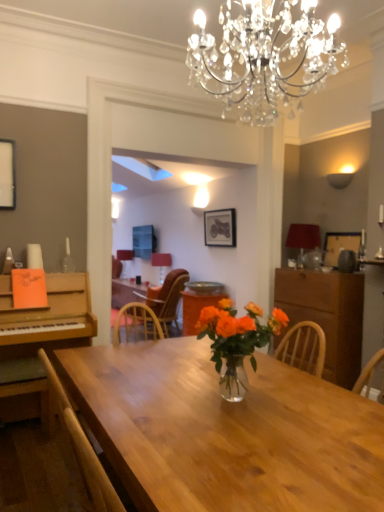
Question: Is transparent glass bottle at left in front of or behind wooden chair at lower left, the 2th chair positioned from the back, in the image?

Choices:
 (A) front
 (B) behind

Answer: (B)

Question: Is point (71, 268) closer or farther from the camera than point (8, 368)?

Choices:
 (A) closer
 (B) farther

Answer: (B)

Question: Based on their relative distances, which object is nearer to the wooden chair at center, the second chair when ordered from front to back?

Choices:
 (A) matte red lampshade at center, marked as the 1th lamp in a front-to-back arrangement
 (B) transparent glass bottle at left
 (C) shiny wood table at center
 (D) matte white lampshade at center, which ranks as the second lamp in front-to-back order
 (E) wooden chair at lower left, the first chair from the left

Answer: (D)

Question: Considering the real-world distances, which object is closest to the black matte picture frame at upper center, acting as the first picture frame starting from the back?

Choices:
 (A) shiny wood table at center
 (B) translucent glass vase at center
 (C) matte red lampshade at center, marked as the 1th lamp in a front-to-back arrangement
 (D) matte white lampshade at center, which ranks as the 1th lamp in left-to-right order
 (E) transparent glass bottle at left

Answer: (C)